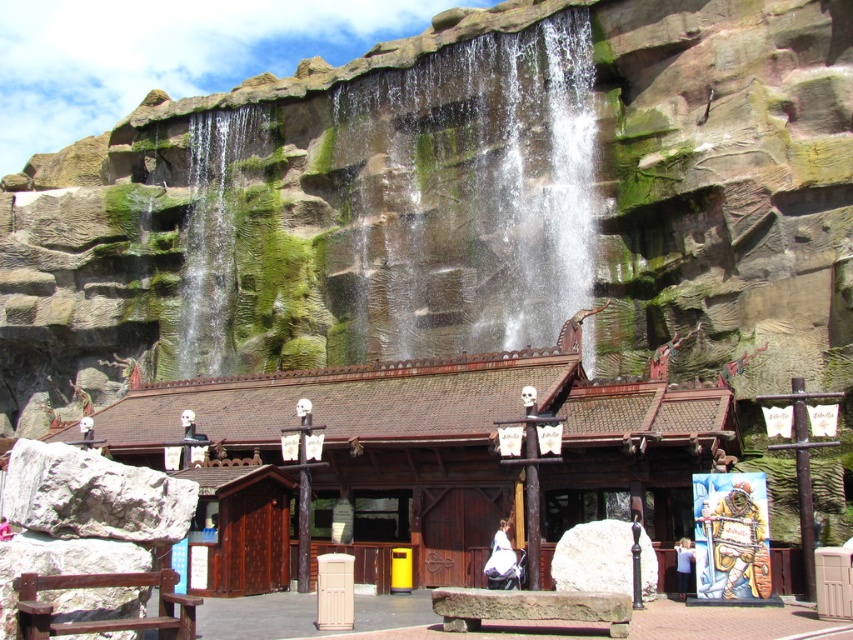
The image size is (853, 640). What do you see at coordinates (466, 196) in the screenshot?
I see `green mossy rock at center` at bounding box center [466, 196].

Is green mossy rock at center below white cotton dress at center?

Incorrect, green mossy rock at center is not positioned below white cotton dress at center.

Is point (540, 202) in front of point (492, 545)?

That is False.

At what (x,y) coordinates should I click in order to perform the action: click on green mossy rock at center. Please return your answer as a coordinate pair (x, y). Image resolution: width=853 pixels, height=640 pixels. Looking at the image, I should click on (466, 196).

Is green mossy rock at upper left thinner than white cotton dress at center?

No, green mossy rock at upper left is not thinner than white cotton dress at center.

Does green mossy rock at upper left appear over white cotton dress at center?

Correct, green mossy rock at upper left is located above white cotton dress at center.

Which is behind, point (229, 353) or point (519, 584)?

Positioned behind is point (229, 353).

Find the location of a particular element. green mossy rock at upper left is located at coordinates (212, 236).

Is green mossy rock at center positioned behind green mossy rock at upper left?

No, green mossy rock at center is in front of green mossy rock at upper left.

Can you confirm if green mossy rock at center is wider than green mossy rock at upper left?

Correct, the width of green mossy rock at center exceeds that of green mossy rock at upper left.

Which is behind, point (476, 184) or point (178, 365)?

The point (178, 365) is more distant.

Find the location of a particular element. The width and height of the screenshot is (853, 640). green mossy rock at center is located at coordinates (466, 196).